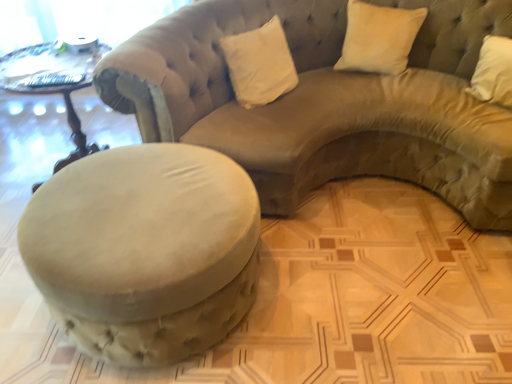
Question: Can you confirm if suede beige studio couch at center is wider than white velvet pillow at upper right, acting as the first pillow starting from the right?

Choices:
 (A) no
 (B) yes

Answer: (B)

Question: Could white velvet pillow at upper right, acting as the first pillow starting from the right, be considered to be inside suede beige studio couch at center?

Choices:
 (A) no
 (B) yes

Answer: (B)

Question: Is suede beige studio couch at center at the left side of white velvet pillow at upper right, marked as the 2th pillow in a left-to-right arrangement?

Choices:
 (A) no
 (B) yes

Answer: (B)

Question: Is suede beige studio couch at center oriented towards white velvet pillow at upper right, marked as the 2th pillow in a left-to-right arrangement?

Choices:
 (A) yes
 (B) no

Answer: (A)

Question: Is suede beige studio couch at center positioned beyond the bounds of white velvet pillow at upper right, acting as the first pillow starting from the right?

Choices:
 (A) no
 (B) yes

Answer: (B)

Question: In terms of size, does wooden carved table at left appear bigger or smaller than suede beige studio couch at center?

Choices:
 (A) small
 (B) big

Answer: (A)

Question: Is point (45, 54) closer or farther from the camera than point (448, 198)?

Choices:
 (A) farther
 (B) closer

Answer: (B)

Question: From a real-world perspective, is wooden carved table at left positioned above or below suede beige studio couch at center?

Choices:
 (A) below
 (B) above

Answer: (A)

Question: From the image's perspective, is wooden carved table at left positioned above or below suede beige studio couch at center?

Choices:
 (A) above
 (B) below

Answer: (B)

Question: Considering their positions, is white velvet pillow at upper center, the second pillow when ordered from right to left, located in front of or behind suede ottoman at lower left?

Choices:
 (A) front
 (B) behind

Answer: (B)

Question: In the image, is white velvet pillow at upper center, placed as the first pillow when sorted from left to right, on the left side or the right side of suede ottoman at lower left?

Choices:
 (A) left
 (B) right

Answer: (B)

Question: From the image's perspective, is white velvet pillow at upper center, placed as the first pillow when sorted from left to right, located above or below suede ottoman at lower left?

Choices:
 (A) above
 (B) below

Answer: (A)

Question: Looking at the image, does white velvet pillow at upper center, the second pillow when ordered from right to left, seem bigger or smaller compared to suede ottoman at lower left?

Choices:
 (A) small
 (B) big

Answer: (A)

Question: Is point (231, 39) positioned closer to the camera than point (77, 142)?

Choices:
 (A) farther
 (B) closer

Answer: (B)

Question: Considering the positions of white velvet pillow at upper center, the second pillow when ordered from right to left, and wooden carved table at left in the image, is white velvet pillow at upper center, the second pillow when ordered from right to left, bigger or smaller than wooden carved table at left?

Choices:
 (A) small
 (B) big

Answer: (A)